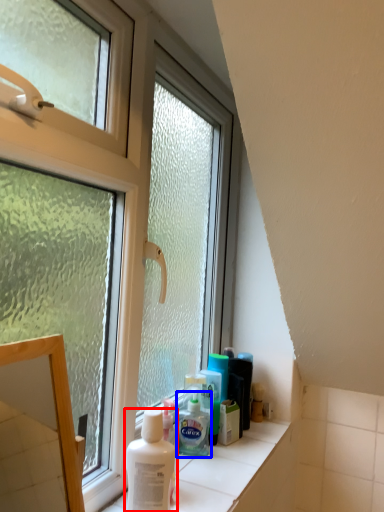
Question: Which object is further to the camera taking this photo, shaving cream (highlighted by a red box) or shaving cream (highlighted by a blue box)?

Choices:
 (A) shaving cream
 (B) shaving cream

Answer: (B)